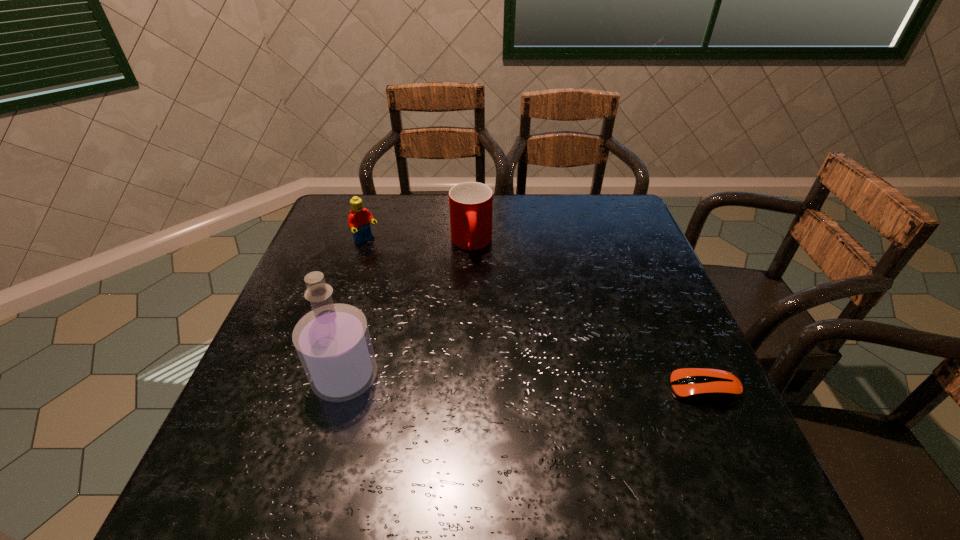
Where is `object that is at the far left corner`? This screenshot has height=540, width=960. object that is at the far left corner is located at coordinates (359, 219).

The image size is (960, 540). Find the location of `object that is at the near left corner`. object that is at the near left corner is located at coordinates 333,342.

You are a GUI agent. You are given a task and a screenshot of the screen. Output one action in this format:
    pyautogui.click(x=<x>, y=<y>)
    Task: Click on the object positioned at the near right corner
    
    Given the screenshot: What is the action you would take?
    pyautogui.click(x=705, y=385)

The image size is (960, 540). In order to click on vacant space at the far edge of the desktop in this screenshot , I will do `click(522, 194)`.

Image resolution: width=960 pixels, height=540 pixels. Identify the location of free spot at the near edge of the desktop. (581, 444).

The image size is (960, 540). What are the coordinates of `free space at the left edge of the desktop` in the screenshot? It's located at (320, 240).

At what (x,y) coordinates should I click in order to perform the action: click on vacant space at the right edge. Please return your answer as a coordinate pair (x, y). The height and width of the screenshot is (540, 960). Looking at the image, I should click on (605, 292).

You are a GUI agent. You are given a task and a screenshot of the screen. Output one action in this format:
    pyautogui.click(x=<x>, y=<y>)
    Task: Click on the vacant space at the near right corner
    This screenshot has width=960, height=540.
    Given the screenshot: What is the action you would take?
    pyautogui.click(x=656, y=428)

Locate an element on the screen. vacant region between the Lego and the cup is located at coordinates [x=419, y=242].

Find the location of a particular element. The height and width of the screenshot is (540, 960). free point between the shortest object and the Lego is located at coordinates (536, 315).